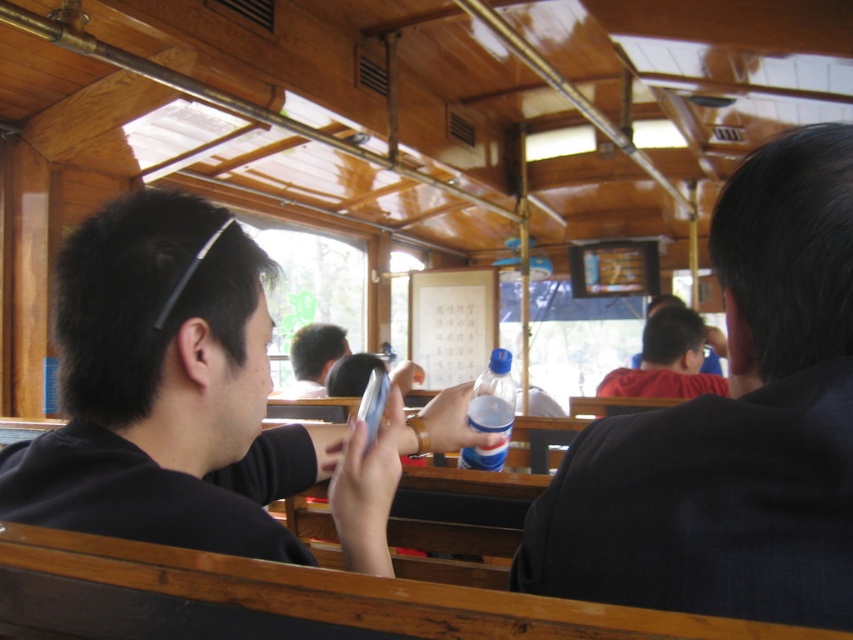
You are a photographer positioned in the vintage train car. You need to capture a photo of both the dark blue suit at right and the black matte phone at left. Which object should you focus on first to ensure both are in frame?

You should focus on the dark blue suit at right first because it is much taller than the black matte phone at left, ensuring it fits within the frame while the smaller phone remains visible.